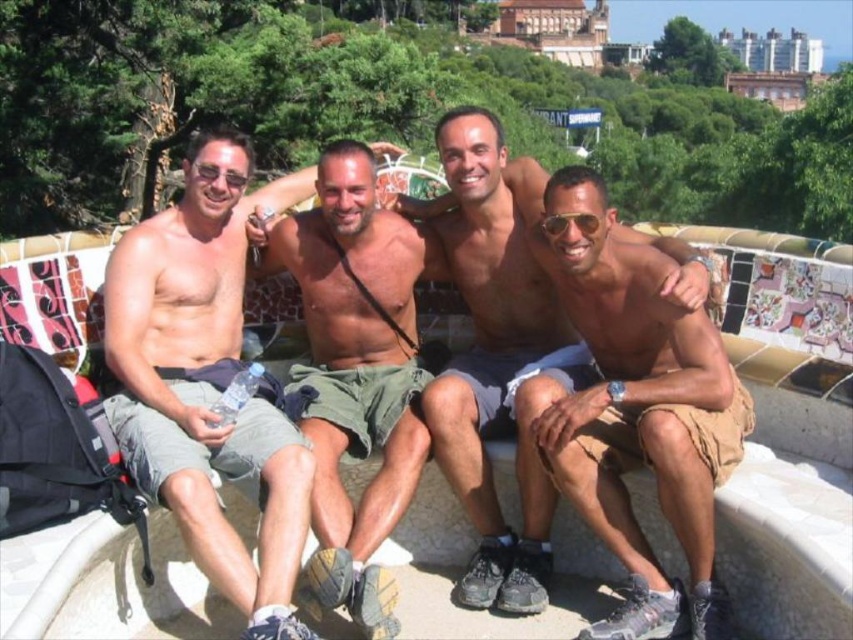
Can you confirm if tan fabric shorts at right is wider than green cotton shorts at center?

Indeed, tan fabric shorts at right has a greater width compared to green cotton shorts at center.

Where is `tan fabric shorts at right`? tan fabric shorts at right is located at coordinates point(639,410).

What do you see at coordinates (206, 380) in the screenshot? Image resolution: width=853 pixels, height=640 pixels. I see `matte gray shorts at center` at bounding box center [206, 380].

Who is positioned more to the left, matte gray shorts at center or green cotton shorts at center?

matte gray shorts at center is more to the left.

What do you see at coordinates (206, 380) in the screenshot? This screenshot has width=853, height=640. I see `matte gray shorts at center` at bounding box center [206, 380].

At what (x,y) coordinates should I click in order to perform the action: click on matte gray shorts at center. Please return your answer as a coordinate pair (x, y). Image resolution: width=853 pixels, height=640 pixels. Looking at the image, I should click on (206, 380).

This screenshot has height=640, width=853. What do you see at coordinates (787, 433) in the screenshot?
I see `white mosaic bench at center` at bounding box center [787, 433].

Does white mosaic bench at center appear over green cotton shorts at center?

Incorrect, white mosaic bench at center is not positioned above green cotton shorts at center.

You are a GUI agent. You are given a task and a screenshot of the screen. Output one action in this format:
    pyautogui.click(x=<x>, y=<y>)
    Task: Click on the white mosaic bench at center
    The image size is (853, 640).
    Given the screenshot: What is the action you would take?
    pyautogui.click(x=787, y=433)

Image resolution: width=853 pixels, height=640 pixels. In order to click on white mosaic bench at center in this screenshot , I will do `click(787, 433)`.